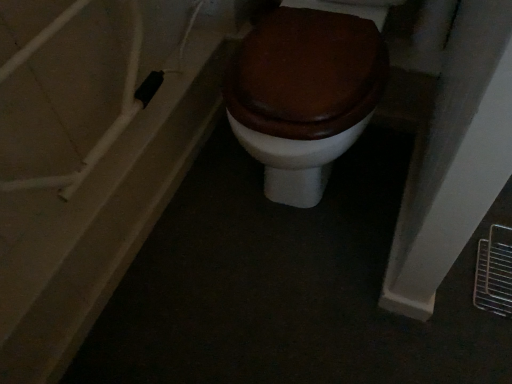
Question: From a real-world perspective, is matte white door at left above or below matte brown wood toilet at center?

Choices:
 (A) above
 (B) below

Answer: (B)

Question: Considering the positions of matte white door at left and matte brown wood toilet at center in the image, is matte white door at left wider or thinner than matte brown wood toilet at center?

Choices:
 (A) thin
 (B) wide

Answer: (B)

Question: From the image's perspective, is matte white door at left above or below matte brown wood toilet at center?

Choices:
 (A) below
 (B) above

Answer: (A)

Question: Is point (312, 82) positioned closer to the camera than point (61, 150)?

Choices:
 (A) farther
 (B) closer

Answer: (B)

Question: Considering the positions of matte brown wood toilet at center and matte white door at left in the image, is matte brown wood toilet at center bigger or smaller than matte white door at left?

Choices:
 (A) small
 (B) big

Answer: (B)

Question: Looking at their shapes, would you say matte brown wood toilet at center is wider or thinner than matte white door at left?

Choices:
 (A) wide
 (B) thin

Answer: (B)

Question: Is matte brown wood toilet at center taller or shorter than matte white door at left?

Choices:
 (A) tall
 (B) short

Answer: (A)